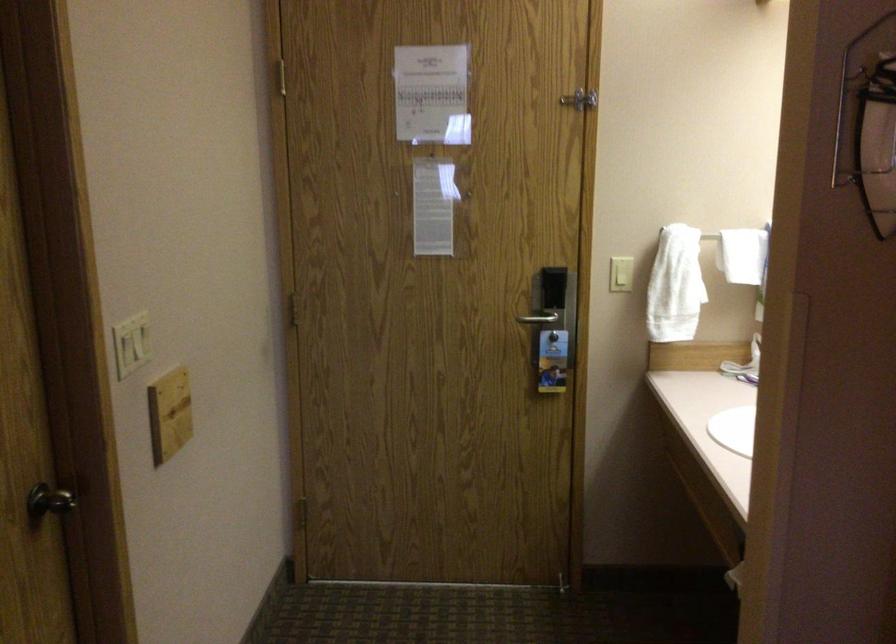
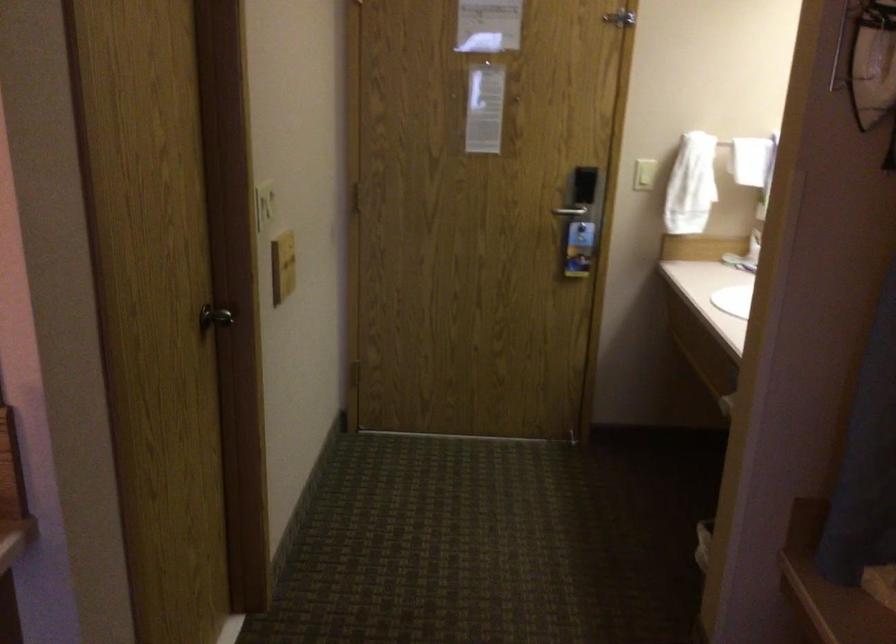
Question: The first image is from the beginning of the video and the second image is from the end. How did the camera likely rotate when shooting the video?

Choices:
 (A) Left
 (B) Right
 (C) Up
 (D) Down

Answer: (D)